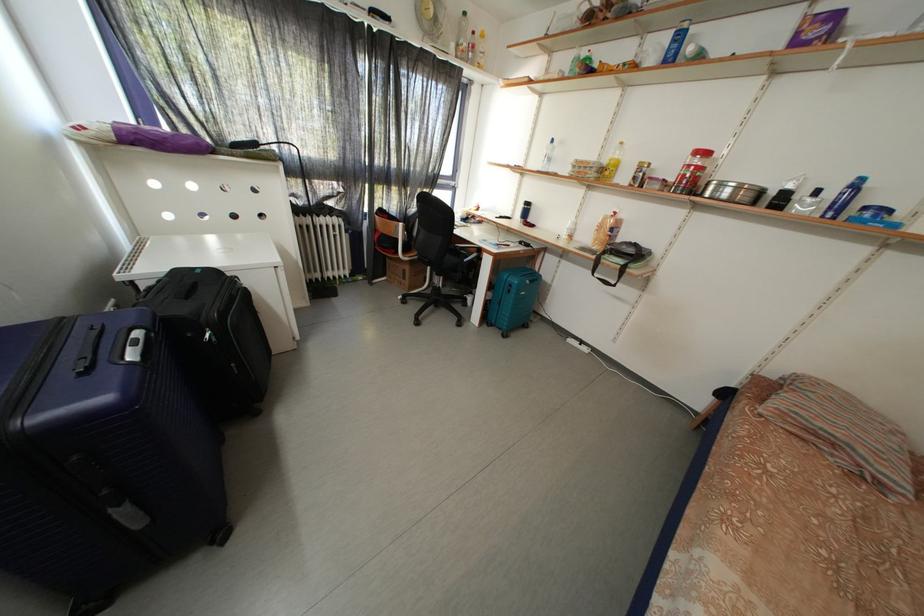
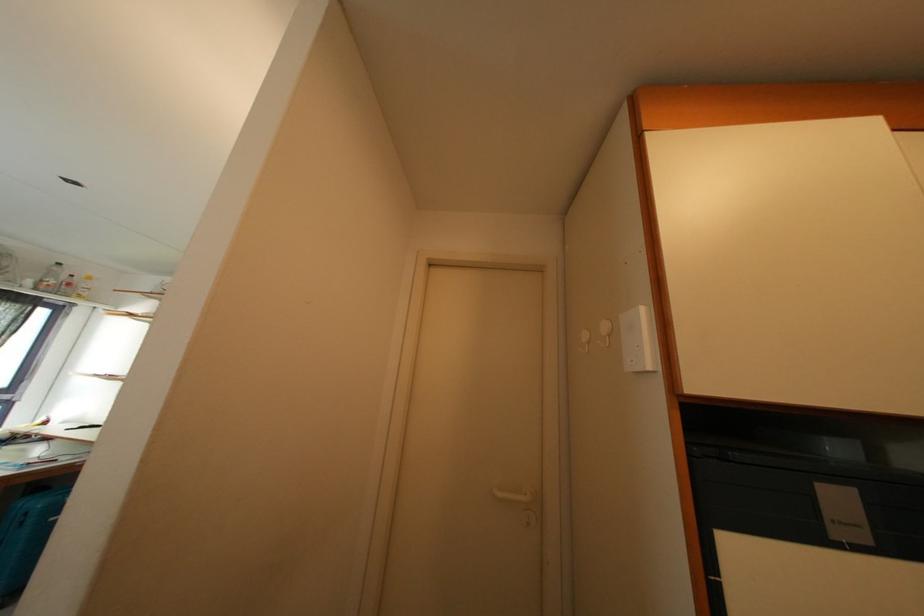
Locate, in the second image, the point that corresponds to pixel 460 52 in the first image.

(38, 286)